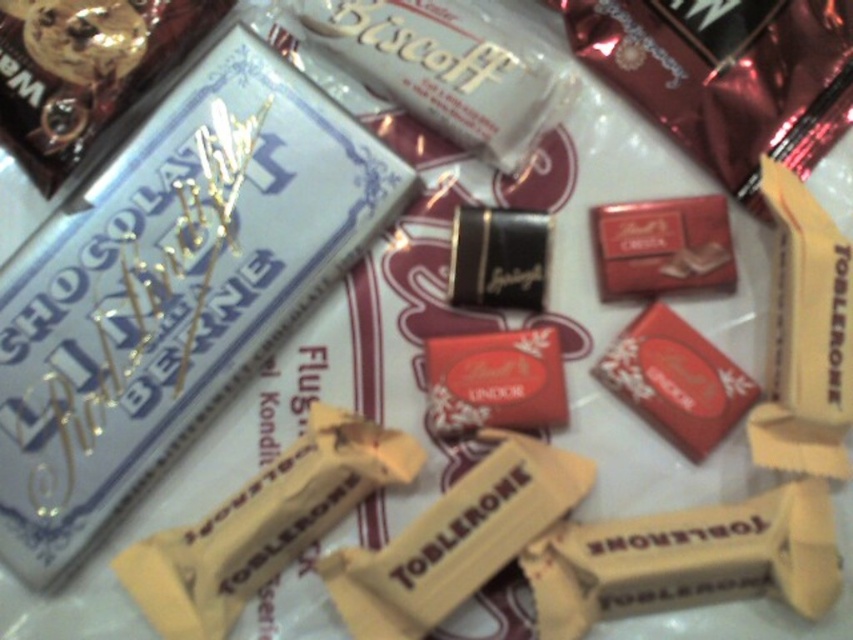
At what (x,y) coordinates should I click in order to perform the action: click on shiny red chocolate bar at center. Please return your answer as a coordinate pair (x, y). Image resolution: width=853 pixels, height=640 pixels. Looking at the image, I should click on (663, 244).

Is point (721, 253) positioned behind point (502, 237)?

No, (721, 253) is in front of (502, 237).

Identify the location of shiny red chocolate bar at center. This screenshot has height=640, width=853. (663, 244).